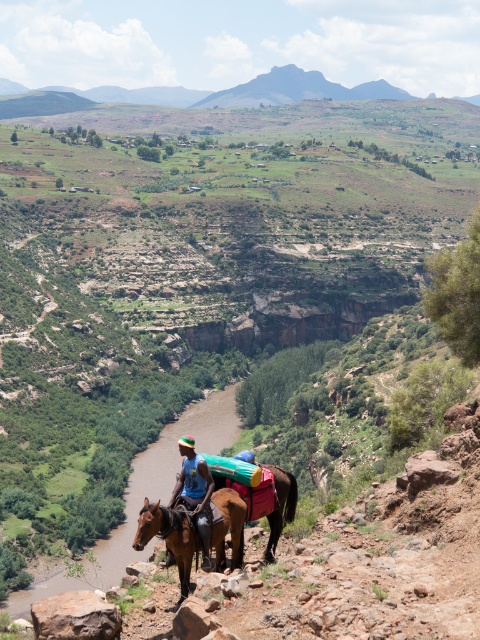
Question: Does brown glossy horse at lower center appear on the right side of brown leather donkey at center?

Choices:
 (A) no
 (B) yes

Answer: (A)

Question: Is brown glossy horse at lower center positioned in front of blue fabric shirt at center?

Choices:
 (A) no
 (B) yes

Answer: (B)

Question: Which point is closer to the camera?

Choices:
 (A) brown leather donkey at center
 (B) blue fabric shirt at center

Answer: (B)

Question: Where is brown leather donkey at center located in relation to blue fabric shirt at center in the image?

Choices:
 (A) left
 (B) right

Answer: (B)

Question: Which point appears closest to the camera in this image?

Choices:
 (A) (273, 557)
 (B) (194, 458)
 (C) (166, 531)

Answer: (C)

Question: Which of the following is the closest to the observer?

Choices:
 (A) (287, 484)
 (B) (181, 444)
 (C) (151, 536)

Answer: (C)